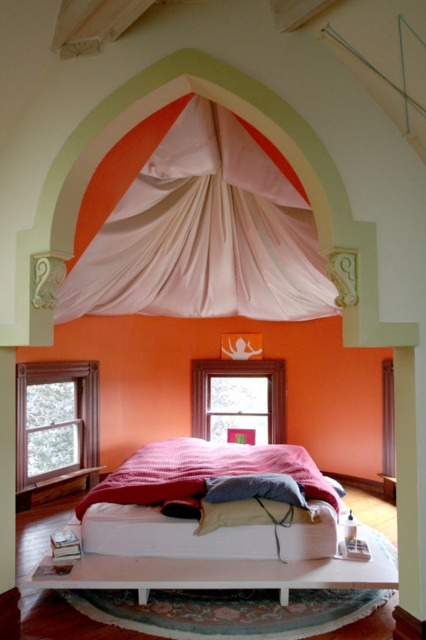
Question: Can you confirm if matte white bed at center is positioned to the right of white matte bed frame at center?

Choices:
 (A) no
 (B) yes

Answer: (B)

Question: Is matte wooden window at center wider than blue cotton pillow at center?

Choices:
 (A) no
 (B) yes

Answer: (B)

Question: Which of the following is the farthest from the observer?

Choices:
 (A) clear glass window at lower left
 (B) white satin curtain at upper center
 (C) matte white bed at center

Answer: (A)

Question: Which of the following is the closest to the observer?

Choices:
 (A) blue cotton pillow at center
 (B) matte white bed at center
 (C) white satin curtain at upper center
 (D) red textured blanket at center

Answer: (B)

Question: Is white satin curtain at upper center below matte white bed at center?

Choices:
 (A) no
 (B) yes

Answer: (A)

Question: Which object is farther from the camera taking this photo?

Choices:
 (A) white matte bed frame at center
 (B) blue cotton pillow at center
 (C) matte wooden window at center
 (D) red textured blanket at center

Answer: (C)